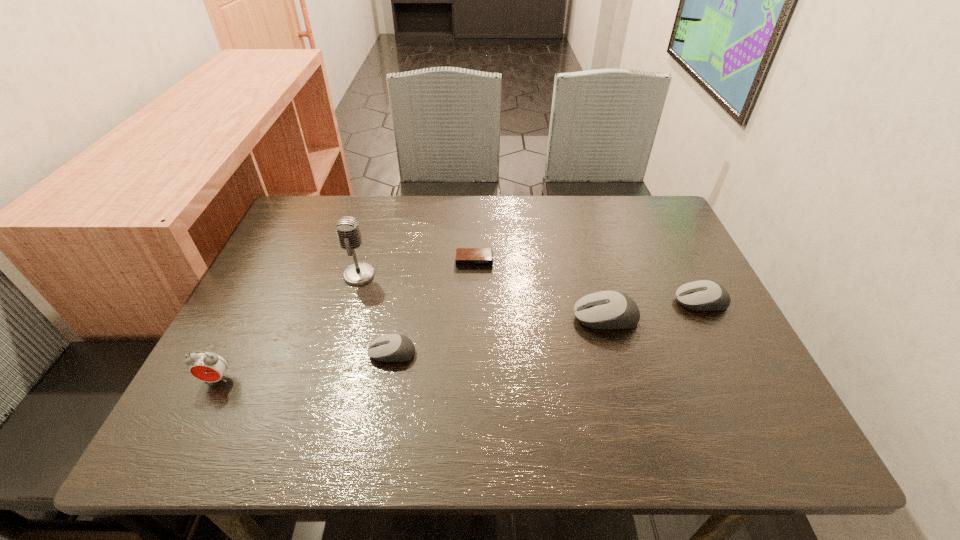
This screenshot has width=960, height=540. Identify the location of vacant area that lies between the tallest object and the fifth object from left to right. (482, 296).

At what (x,y) coordinates should I click in order to perform the action: click on vacant space that is in between the shortest object and the nearest object. Please return your answer as a coordinate pair (x, y). The image size is (960, 540). Looking at the image, I should click on (346, 320).

The width and height of the screenshot is (960, 540). Identify the location of free area in between the fourth shortest object and the microphone. (482, 296).

Image resolution: width=960 pixels, height=540 pixels. Identify the location of vacant space that's between the rightmost computer equipment and the shortest computer equipment. (546, 328).

Image resolution: width=960 pixels, height=540 pixels. Find the location of `free space between the fourth object from left to right and the third tallest object`. free space between the fourth object from left to right and the third tallest object is located at coordinates (540, 289).

Locate an element on the screen. The image size is (960, 540). object that is the fifth closest one to the nearer alarm clock is located at coordinates click(703, 295).

I want to click on object that stands as the closest to the shorter alarm clock, so click(x=347, y=228).

I want to click on computer equipment that can be found as the closest to the third shortest object, so click(x=607, y=309).

Locate an element on the screen. The height and width of the screenshot is (540, 960). computer equipment that stands as the closest to the rightmost computer equipment is located at coordinates (607, 309).

What are the coordinates of `free location that satisfies the following two spatial constraints: 1. on the front face of the shorter alarm clock; 2. on the wheel side of the leftmost computer equipment` in the screenshot? It's located at (473, 353).